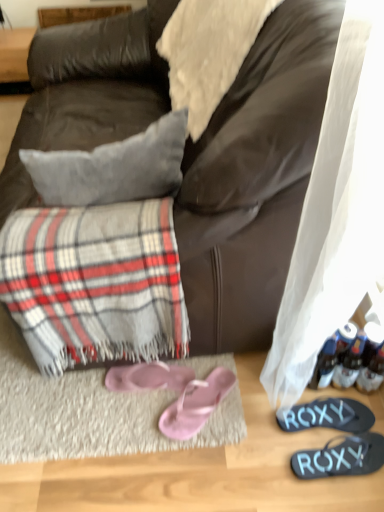
Question: From a real-world perspective, is pink fabric flip-flops at lower center, which appears as the first footwear when viewed from the left, located higher than pink satin flip-flops at lower center, which is the 3th footwear in right-to-left order?

Choices:
 (A) no
 (B) yes

Answer: (B)

Question: Is pink fabric flip-flops at lower center, which is counted as the 4th footwear, starting from the right, not inside pink satin flip-flops at lower center, which is the 3th footwear in right-to-left order?

Choices:
 (A) no
 (B) yes

Answer: (B)

Question: Is pink fabric flip-flops at lower center, which appears as the first footwear when viewed from the left, in front of pink satin flip-flops at lower center, which is the 3th footwear in right-to-left order?

Choices:
 (A) no
 (B) yes

Answer: (A)

Question: Is pink satin flip-flops at lower center, which is the 3th footwear in right-to-left order, a part of pink fabric flip-flops at lower center, which appears as the first footwear when viewed from the left?

Choices:
 (A) yes
 (B) no

Answer: (B)

Question: Are pink fabric flip-flops at lower center, which appears as the first footwear when viewed from the left, and pink satin flip-flops at lower center, which is the 3th footwear in right-to-left order, making contact?

Choices:
 (A) no
 (B) yes

Answer: (B)

Question: Considering the positions of point (102, 218) and point (339, 402), is point (102, 218) closer or farther from the camera than point (339, 402)?

Choices:
 (A) farther
 (B) closer

Answer: (B)

Question: Would you say plaid fabric at lower left is to the left or to the right of black rubber flip-flops at lower right, the third footwear in the left-to-right sequence, in the picture?

Choices:
 (A) left
 (B) right

Answer: (A)

Question: From the image's perspective, is plaid fabric at lower left positioned above or below black rubber flip-flops at lower right, the third footwear in the left-to-right sequence?

Choices:
 (A) below
 (B) above

Answer: (B)

Question: From a real-world perspective, is plaid fabric at lower left physically located above or below black rubber flip-flops at lower right, marked as the second footwear in a right-to-left arrangement?

Choices:
 (A) below
 (B) above

Answer: (B)

Question: Considering the positions of point (278, 411) and point (200, 226), is point (278, 411) closer or farther from the camera than point (200, 226)?

Choices:
 (A) farther
 (B) closer

Answer: (A)

Question: Considering the positions of black rubber flip-flops at lower right, the third footwear in the left-to-right sequence, and dark brown leather couch at center in the image, is black rubber flip-flops at lower right, the third footwear in the left-to-right sequence, wider or thinner than dark brown leather couch at center?

Choices:
 (A) thin
 (B) wide

Answer: (A)

Question: From a real-world perspective, is black rubber flip-flops at lower right, the third footwear in the left-to-right sequence, above or below dark brown leather couch at center?

Choices:
 (A) above
 (B) below

Answer: (B)

Question: Is black rubber flip-flops at lower right, the third footwear in the left-to-right sequence, bigger or smaller than dark brown leather couch at center?

Choices:
 (A) big
 (B) small

Answer: (B)

Question: From a real-world perspective, is white fuzzy blanket at upper center above or below black rubber flip-flops at lower right, which is the first footwear from right to left?

Choices:
 (A) below
 (B) above

Answer: (B)

Question: From the image's perspective, is white fuzzy blanket at upper center positioned above or below black rubber flip-flops at lower right, which is the first footwear from right to left?

Choices:
 (A) above
 (B) below

Answer: (A)